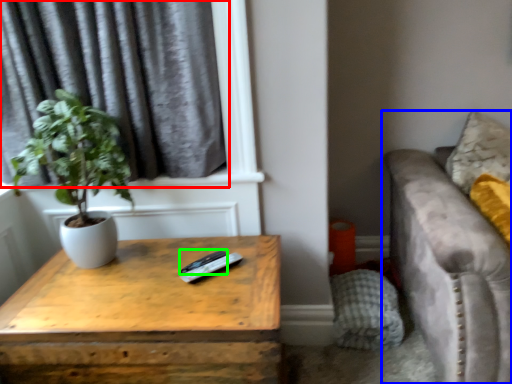
Question: Based on their relative distances, which object is nearer to curtain (highlighted by a red box)? Choose from studio couch (highlighted by a blue box) and remote (highlighted by a green box).

Choices:
 (A) studio couch
 (B) remote

Answer: (B)